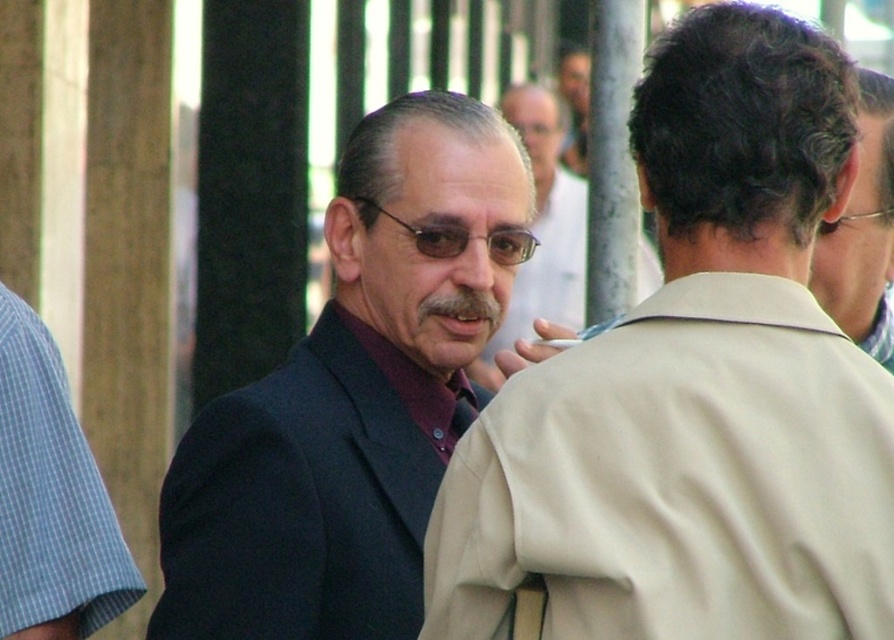
You are standing in the scene and want to throw a small ball to hit the point marked at coordinates point [283,474]. Can you reach it with a single throw?

The point marked at coordinates point [283,474] is 13.27 meters away from the viewer, so you cannot reach it with a single throw as that distance is too far for an average person to throw a small ball.

You are standing at the point labeled as point (x=848, y=228) and want to walk to the point labeled as point (x=260, y=460). According to the scene, will you be moving towards the person on the left or the person on the right?

You will be moving towards the person on the left because point (x=260, y=460) is in front of point (x=848, y=228), meaning it is closer to the camera and thus closer to the person on the left who is facing forward in the image.

You are a fashion designer observing two outfits in the image. The beige smooth trench coat at center and the dark blue suit at center. Which of these two outfits is smaller in size?

The beige smooth trench coat at center has a smaller size compared to the dark blue suit at center, so the beige smooth trench coat at center is the smaller one.